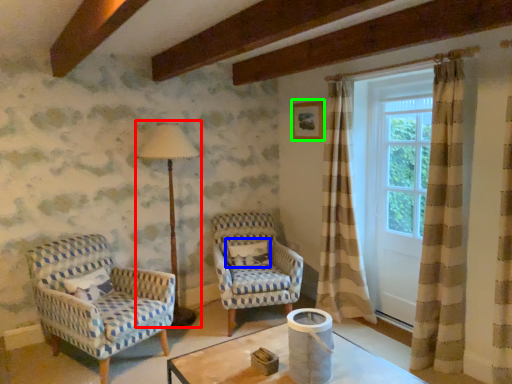
Question: Which object is positioned farthest from table lamp (highlighted by a red box)? Select from pillow (highlighted by a blue box) and picture frame (highlighted by a green box).

Choices:
 (A) pillow
 (B) picture frame

Answer: (B)